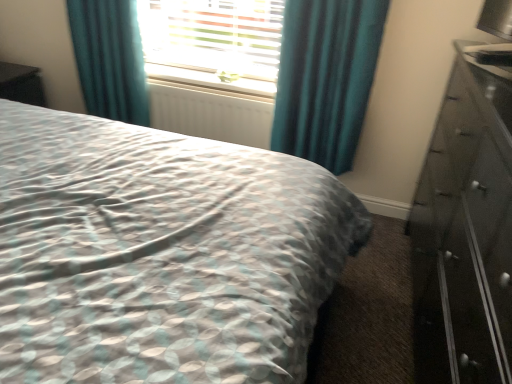
At what (x,y) coordinates should I click in order to perform the action: click on empty space that is ontop of white textured radiator at center (from a real-world perspective). Please return your answer as a coordinate pair (x, y). Looking at the image, I should click on (196, 88).